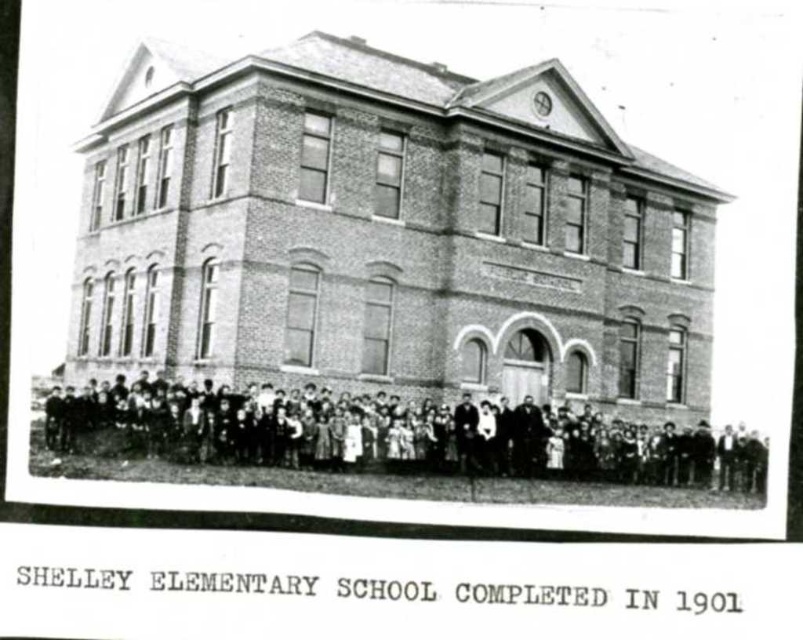
You are standing in front of Shelley Elementary School from the image. The school has a central entrance. Where would you look to find the dark clothing group at center?

The dark clothing group at center is located at the central area in front of Shelley Elementary School, positioned at coordinates approximately 0.683 along the horizontal axis and 0.482 along the vertical axis.

You are standing in front of Shelley Elementary School and see two points marked on the ground. One is labeled as point (177, 461) and the other as point (455, 429). Which point is closer to the entrance of the school?

Point (177, 461) is closer to the entrance of Shelley Elementary School because it is in front of point (455, 429).